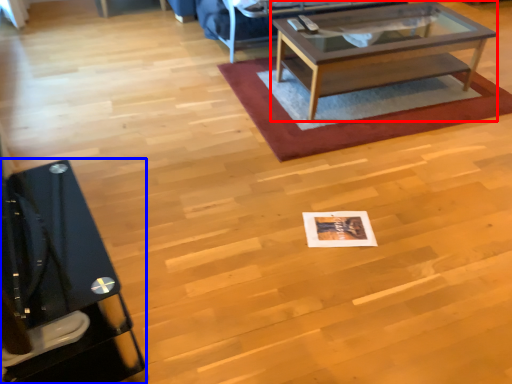
Question: Which object is further to the camera taking this photo, coffee table (highlighted by a red box) or desk (highlighted by a blue box)?

Choices:
 (A) coffee table
 (B) desk

Answer: (A)